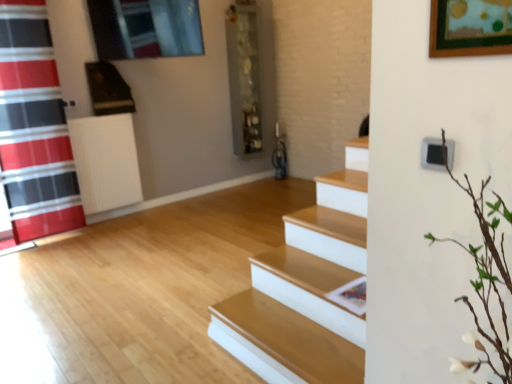
Question: From a real-world perspective, is red plaid shower curtain at left positioned under white plastic radiator at left based on gravity?

Choices:
 (A) no
 (B) yes

Answer: (A)

Question: From the image's perspective, is red plaid shower curtain at left located beneath white plastic radiator at left?

Choices:
 (A) yes
 (B) no

Answer: (B)

Question: From a real-world perspective, is red plaid shower curtain at left positioned over white plastic radiator at left based on gravity?

Choices:
 (A) no
 (B) yes

Answer: (B)

Question: Does red plaid shower curtain at left come in front of white plastic radiator at left?

Choices:
 (A) yes
 (B) no

Answer: (A)

Question: Could you tell me if red plaid shower curtain at left is facing white plastic radiator at left?

Choices:
 (A) no
 (B) yes

Answer: (A)

Question: Would you say metallic gray shelf at center is inside or outside red plaid shower curtain at left?

Choices:
 (A) outside
 (B) inside

Answer: (A)

Question: From a real-world perspective, is metallic gray shelf at center physically located above or below red plaid shower curtain at left?

Choices:
 (A) above
 (B) below

Answer: (A)

Question: In the image, is metallic gray shelf at center positioned in front of or behind red plaid shower curtain at left?

Choices:
 (A) front
 (B) behind

Answer: (B)

Question: From the image's perspective, is metallic gray shelf at center located above or below red plaid shower curtain at left?

Choices:
 (A) below
 (B) above

Answer: (B)

Question: In terms of height, does white plastic radiator at left look taller or shorter compared to red plaid shower curtain at left?

Choices:
 (A) tall
 (B) short

Answer: (B)

Question: Does point [x=105, y=195] appear closer or farther from the camera than point [x=27, y=173]?

Choices:
 (A) farther
 (B) closer

Answer: (A)

Question: Do you think white plastic radiator at left is within red plaid shower curtain at left, or outside of it?

Choices:
 (A) inside
 (B) outside

Answer: (B)

Question: Considering their positions, is white plastic radiator at left located in front of or behind red plaid shower curtain at left?

Choices:
 (A) behind
 (B) front

Answer: (A)

Question: From the image's perspective, is red plaid shower curtain at left positioned above or below metallic gray shelf at center?

Choices:
 (A) below
 (B) above

Answer: (A)

Question: Looking at the image, does red plaid shower curtain at left seem bigger or smaller compared to metallic gray shelf at center?

Choices:
 (A) small
 (B) big

Answer: (B)